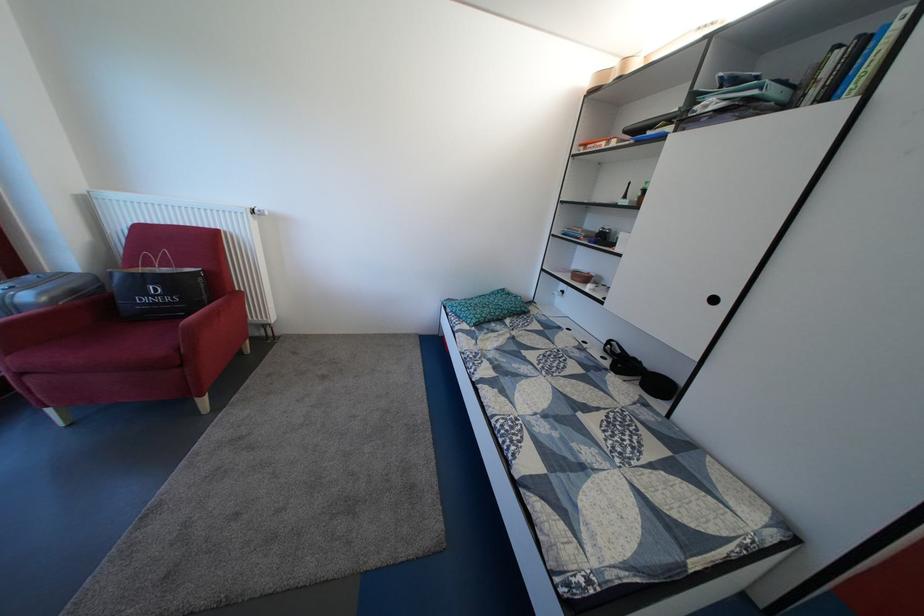
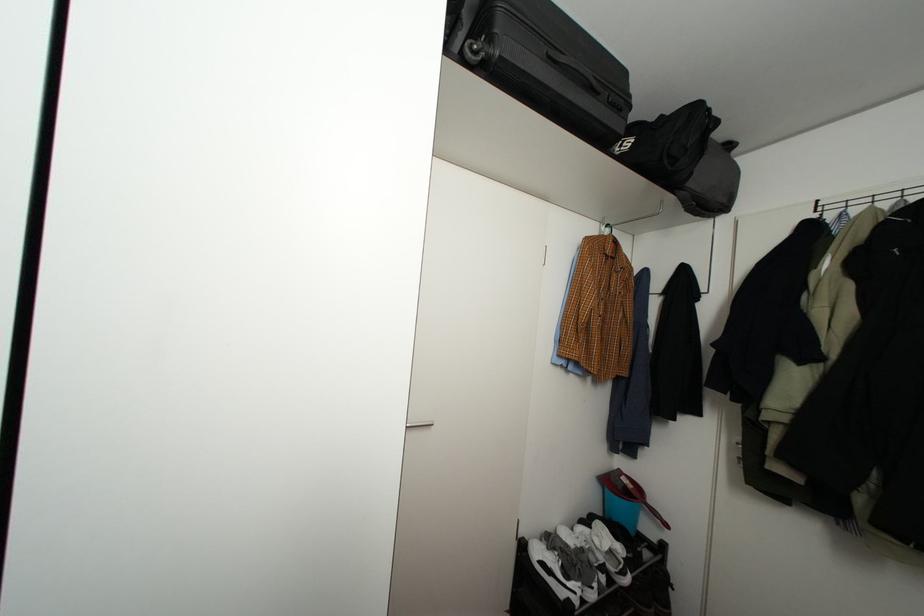
Question: The images are taken continuously from a first-person perspective. In which direction are you moving?

Choices:
 (A) Left
 (B) Right
 (C) Forward
 (D) Backward

Answer: (B)